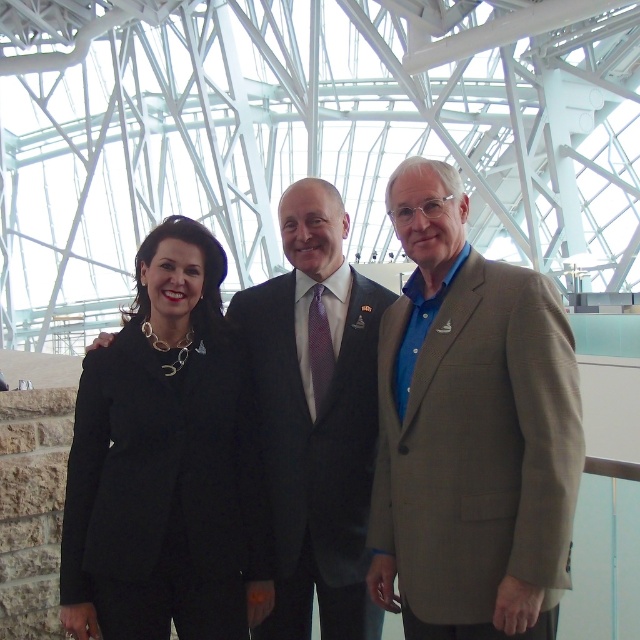
Question: Which point appears farthest from the camera in this image?

Choices:
 (A) (372, 456)
 (B) (404, 385)
 (C) (394, 563)
 (D) (122, 444)

Answer: (A)

Question: Which of the following is the farthest from the observer?

Choices:
 (A) dark gray suit at center
 (B) light brown textured blazer at center
 (C) black fabric suit at left

Answer: (A)

Question: Which object is the closest to the black fabric suit at center?

Choices:
 (A) dark gray suit at center
 (B) light brown textured blazer at center

Answer: (B)

Question: From the image, what is the correct spatial relationship of light brown textured blazer at center in relation to black fabric suit at left?

Choices:
 (A) below
 (B) above

Answer: (B)

Question: Where is black fabric suit at center located in relation to dark gray suit at center in the image?

Choices:
 (A) left
 (B) right

Answer: (A)

Question: Does black fabric suit at left have a greater width compared to dark gray suit at center?

Choices:
 (A) no
 (B) yes

Answer: (B)